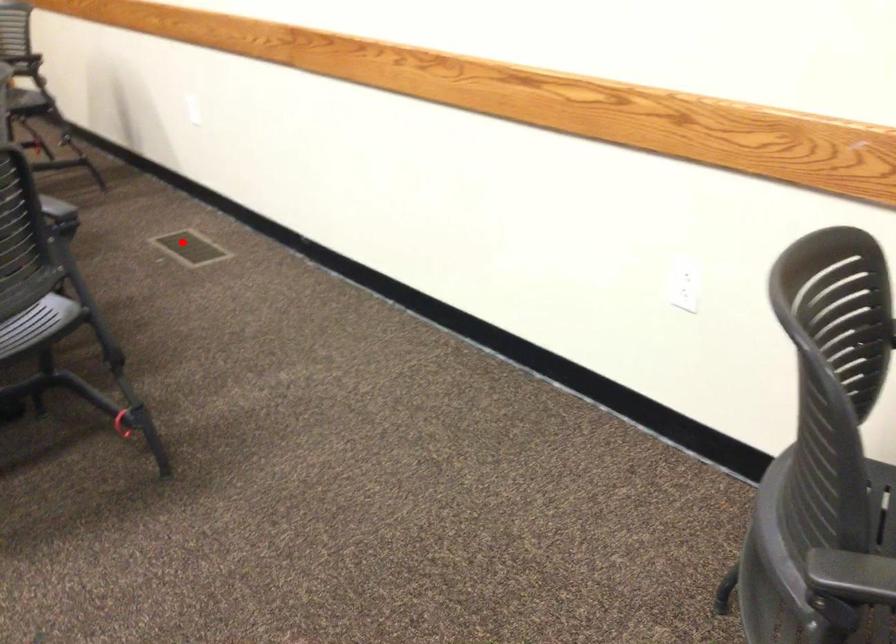
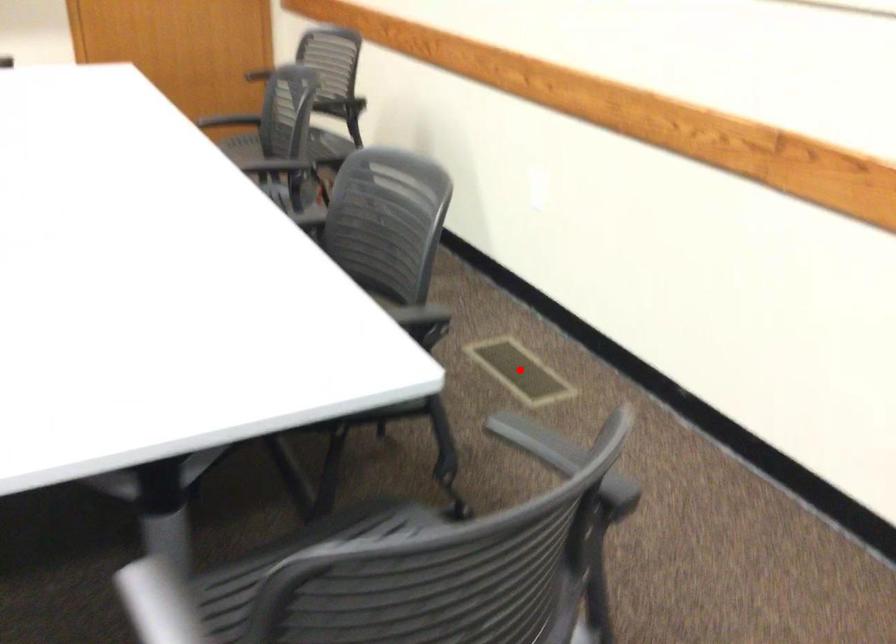
I am providing you with two images of the same scene from different viewpoints. A red point is marked on the first image and another point is marked on the second image. Is the red point in image1 aligned with the point shown in image2?

Yes